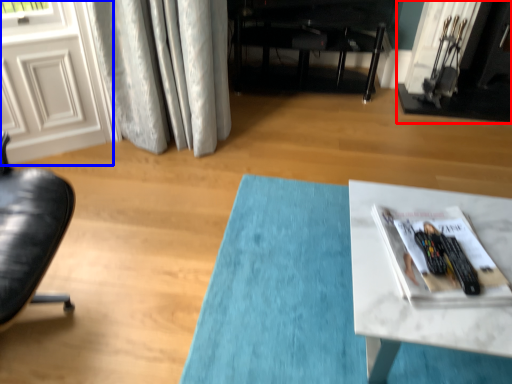
Question: Which point is further to the camera, fireplace (highlighted by a red box) or screen door (highlighted by a blue box)?

Choices:
 (A) fireplace
 (B) screen door

Answer: (A)